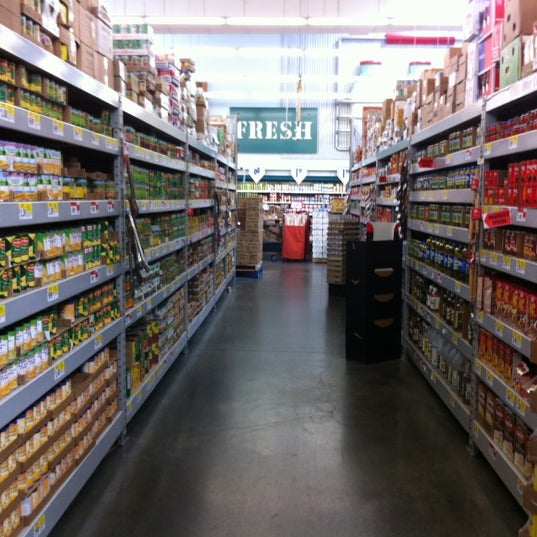
The width and height of the screenshot is (537, 537). I want to click on overhead light, so click(275, 18), click(273, 43), click(268, 79), click(268, 95).